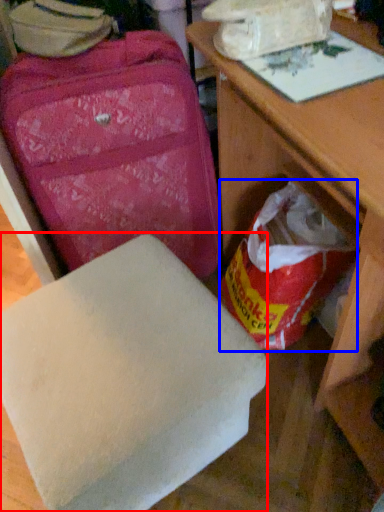
Question: Among these objects, which one is farthest to the camera, furniture (highlighted by a red box) or grocery bag (highlighted by a blue box)?

Choices:
 (A) furniture
 (B) grocery bag

Answer: (B)